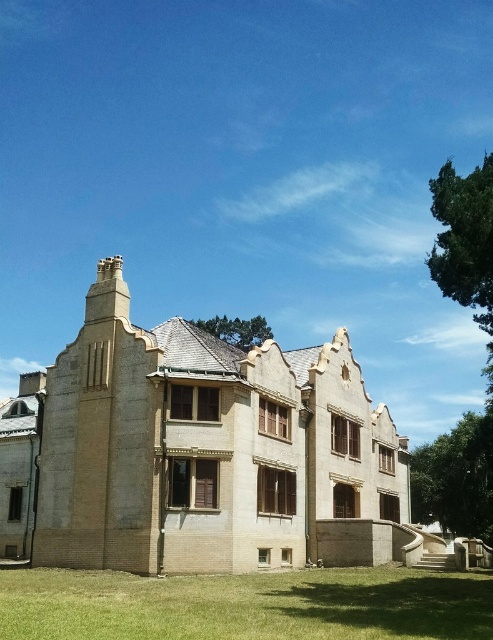
Question: Which of the following is the farthest from the observer?

Choices:
 (A) (157, 605)
 (B) (277, 502)

Answer: (B)

Question: Does beige brick mansion at center have a lesser width compared to green grass at lower center?

Choices:
 (A) yes
 (B) no

Answer: (B)

Question: Which of the following is the closest to the observer?

Choices:
 (A) green grass at lower center
 (B) beige brick mansion at center

Answer: (A)

Question: Is beige brick mansion at center thinner than green grass at lower center?

Choices:
 (A) no
 (B) yes

Answer: (A)

Question: Is the position of beige brick mansion at center more distant than that of green grass at lower center?

Choices:
 (A) no
 (B) yes

Answer: (B)